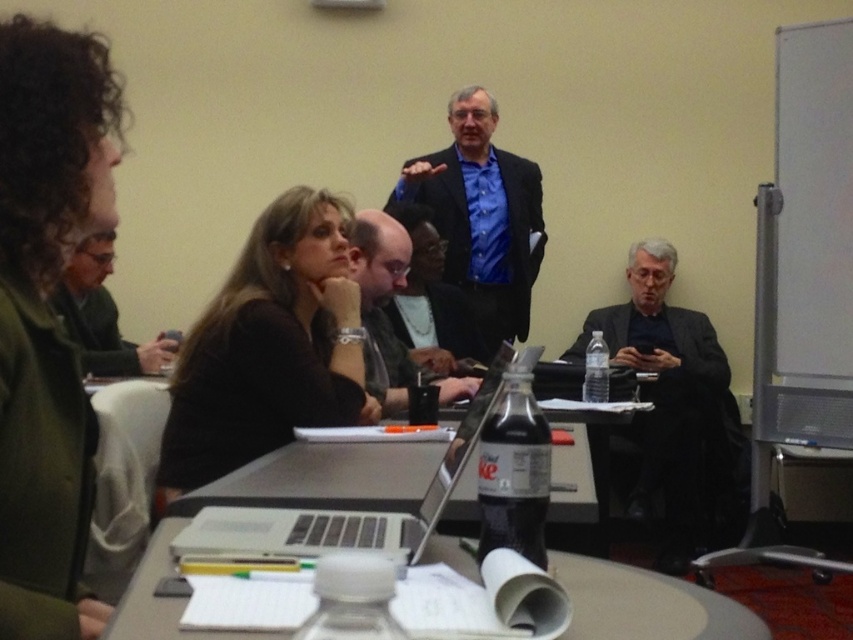
Is black matte shirt at center shorter than black matte suit at right?

Correct, black matte shirt at center is not as tall as black matte suit at right.

Is point (352, 340) positioned in front of point (666, 314)?

Yes, point (352, 340) is in front of point (666, 314).

Find the location of a particular element. black matte shirt at center is located at coordinates (268, 346).

Is black matte suit at right closer to the viewer compared to clear plastic bottle at center?

That is False.

Between point (700, 404) and point (657, 598), which one is positioned in front?

Point (657, 598) is in front.

What do you see at coordinates (671, 401) in the screenshot?
I see `black matte suit at right` at bounding box center [671, 401].

This screenshot has width=853, height=640. I want to click on black matte suit at right, so click(x=671, y=401).

Looking at this image, who is more forward, (318, 291) or (462, 269)?

Positioned in front is point (318, 291).

Is black matte shirt at center thinner than blue matte shirt at center?

Yes, black matte shirt at center is thinner than blue matte shirt at center.

Who is more forward, (253,365) or (502,275)?

Point (253,365) is more forward.

At what (x,y) coordinates should I click in order to perform the action: click on black matte shirt at center. Please return your answer as a coordinate pair (x, y). The height and width of the screenshot is (640, 853). Looking at the image, I should click on (268, 346).